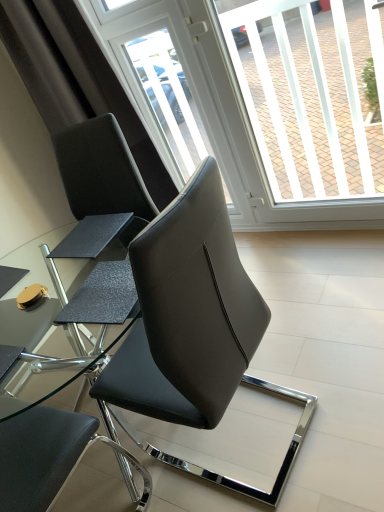
The height and width of the screenshot is (512, 384). What are the coordinates of `vacant space to the right of black leather chair at center, which is the third chair in back-to-front order` in the screenshot? It's located at (326, 362).